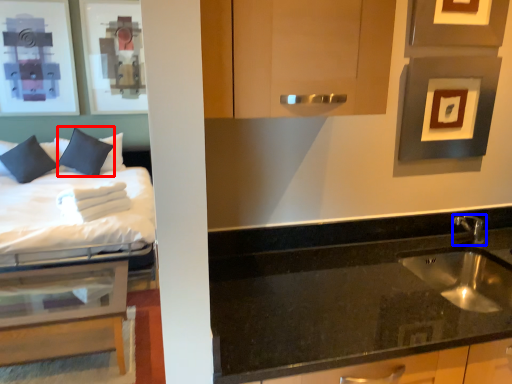
Question: Which object is closer to the camera taking this photo, pillow (highlighted by a red box) or tap (highlighted by a blue box)?

Choices:
 (A) pillow
 (B) tap

Answer: (B)